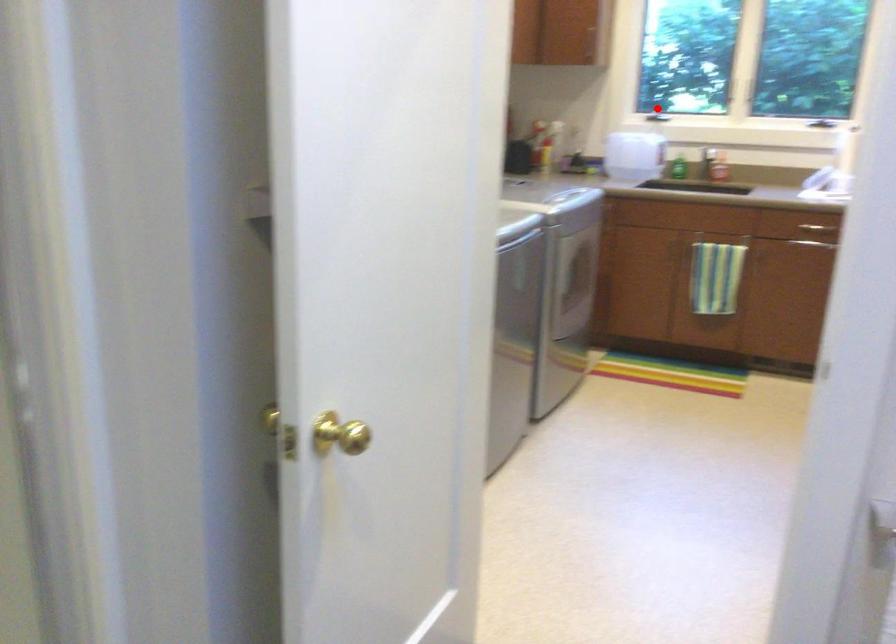
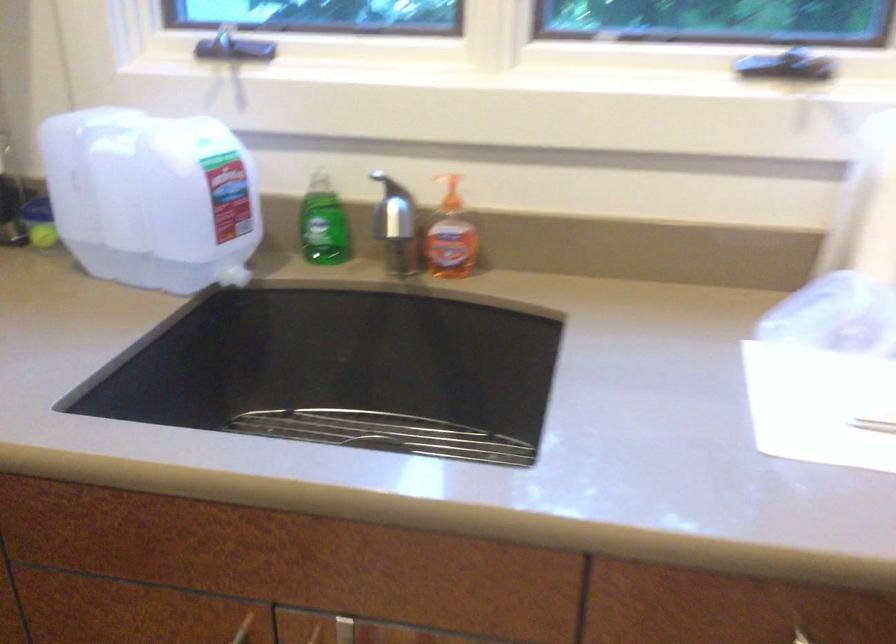
The point at the highlighted location is marked in the first image. Where is the corresponding point in the second image?

(243, 48)